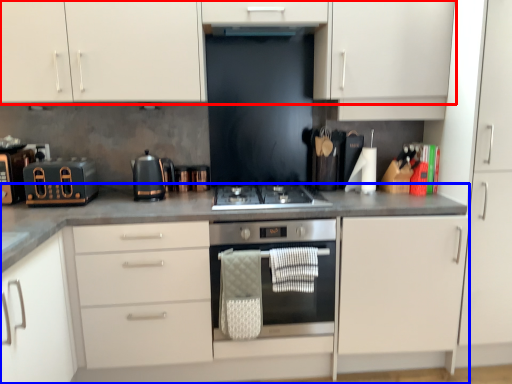
Question: Which object is further to the camera taking this photo, cabinetry (highlighted by a red box) or countertop (highlighted by a blue box)?

Choices:
 (A) cabinetry
 (B) countertop

Answer: (A)